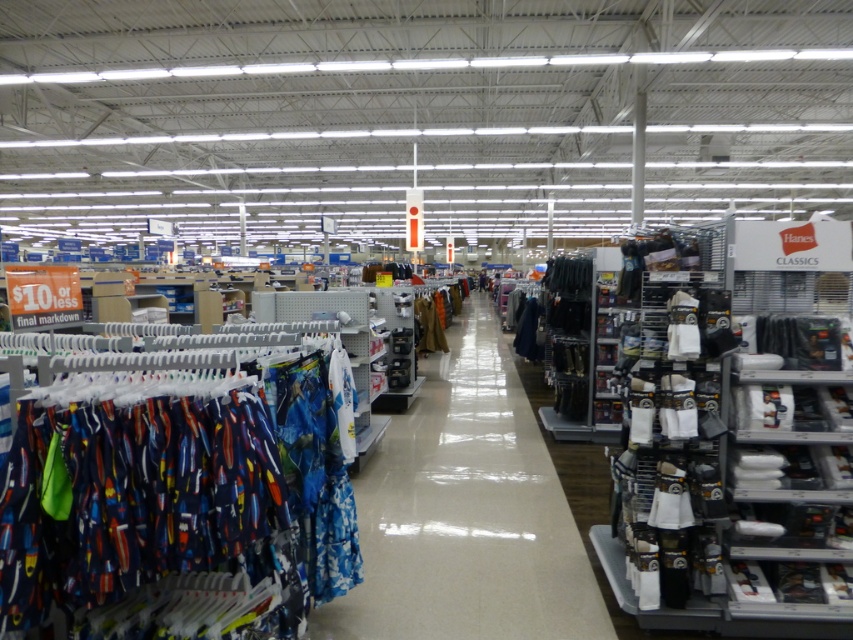
Measure the distance between blue fabric shirts at center and brown leather jacket at center.

4.61 feet

Can you confirm if blue fabric shirts at center is bigger than brown leather jacket at center?

Indeed, blue fabric shirts at center has a larger size compared to brown leather jacket at center.

This screenshot has height=640, width=853. I want to click on blue fabric shirts at center, so click(x=466, y=513).

Looking at this image, is printed cotton shorts at left behind brown leather jacket at center?

No.

Is the position of printed cotton shorts at left less distant than that of brown leather jacket at center?

Yes, it is.

The image size is (853, 640). Identify the location of printed cotton shorts at left. 173,497.

Which of these two, printed cotton shorts at left or blue fabric shirts at center, stands shorter?

blue fabric shirts at center is shorter.

Does point (83, 509) come farther from viewer compared to point (442, 516)?

No, (83, 509) is closer to viewer.

Where is `printed cotton shorts at left`? The width and height of the screenshot is (853, 640). printed cotton shorts at left is located at coordinates (173, 497).